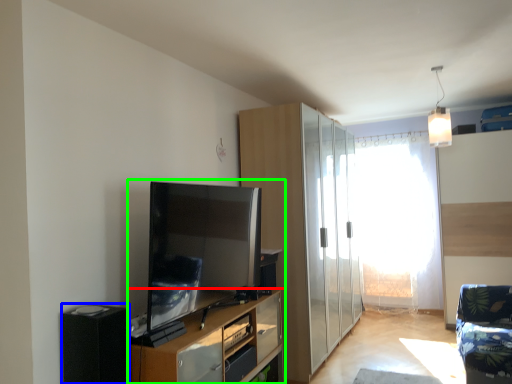
Question: Considering the real-world distances, which object is closest to cupboard (highlighted by a red box)? appliance (highlighted by a blue box) or entertainment center (highlighted by a green box).

Choices:
 (A) appliance
 (B) entertainment center

Answer: (B)